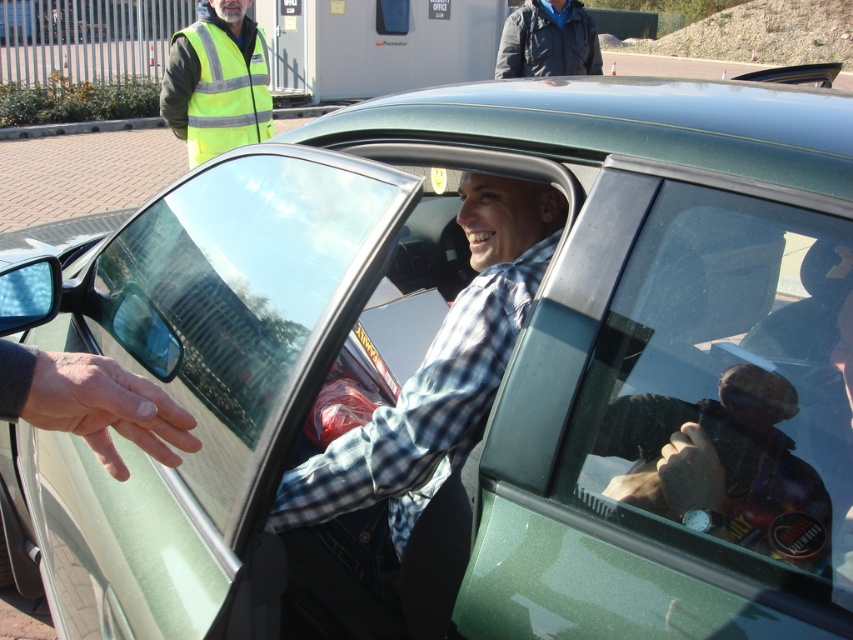
Question: Which point is closer to the camera?

Choices:
 (A) (642, 476)
 (B) (231, 76)
 (C) (494, 349)

Answer: (A)

Question: Does transparent glass at center have a greater width compared to high-visibility fabric safety vest at upper left?

Choices:
 (A) yes
 (B) no

Answer: (B)

Question: Which point is farther to the camera?

Choices:
 (A) transparent glass at center
 (B) checkered fabric shirt at center
 (C) high-visibility fabric safety vest at upper left

Answer: (C)

Question: Is transparent glass at center wider than checkered fabric shirt at center?

Choices:
 (A) no
 (B) yes

Answer: (A)

Question: Is checkered fabric shirt at center behind high-visibility fabric safety vest at upper left?

Choices:
 (A) no
 (B) yes

Answer: (A)

Question: Which point is closer to the camera taking this photo?

Choices:
 (A) (822, 256)
 (B) (351, 477)

Answer: (A)